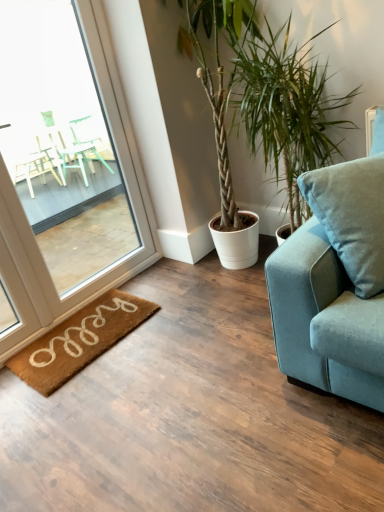
You are a GUI agent. You are given a task and a screenshot of the screen. Output one action in this format:
    pyautogui.click(x=<x>, y=<y>)
    Task: Click on the green leafy plant at center
    
    Given the screenshot: What is the action you would take?
    pyautogui.click(x=262, y=96)

Image resolution: width=384 pixels, height=512 pixels. What are the coordinates of `brown coir mat at lower left` in the screenshot? It's located at (79, 340).

What do you see at coordinates (79, 340) in the screenshot? This screenshot has width=384, height=512. I see `brown coir mat at lower left` at bounding box center [79, 340].

Image resolution: width=384 pixels, height=512 pixels. In order to click on clear glass window at left in this screenshot , I will do `click(64, 169)`.

The height and width of the screenshot is (512, 384). What are the coordinates of `velvet blue couch at right` in the screenshot? It's located at (324, 320).

At what (x,y) coordinates should I click in order to perform the action: click on green leafy plant at center. Please return your answer as a coordinate pair (x, y). Looking at the image, I should click on (262, 96).

Does velvet blue couch at right appear on the right side of green leafy plant at center?

Correct, you'll find velvet blue couch at right to the right of green leafy plant at center.

Relative to green leafy plant at center, is velvet blue couch at right in front or behind?

In the image, velvet blue couch at right appears in front of green leafy plant at center.

From the image's perspective, which is above, velvet blue couch at right or green leafy plant at center?

green leafy plant at center appears higher in the image.

Between point (306, 226) and point (255, 149), which one is positioned behind?

The point (255, 149) is behind.

Find the location of a particular element. The height and width of the screenshot is (512, 384). window that is behind the velvet blue couch at right is located at coordinates pos(64,169).

Can you confirm if clear glass window at left is smaller than velvet blue couch at right?

No, clear glass window at left is not smaller than velvet blue couch at right.

Based on the photo, in terms of height, does clear glass window at left look taller or shorter compared to velvet blue couch at right?

clear glass window at left is taller than velvet blue couch at right.

Considering the relative sizes of clear glass window at left and velvet blue couch at right in the image provided, is clear glass window at left wider than velvet blue couch at right?

No.

Which is closer to the camera, (x=354, y=334) or (x=16, y=370)?

Point (x=354, y=334) is positioned closer to the camera compared to point (x=16, y=370).

Considering the sizes of objects velvet blue couch at right and brown coir mat at lower left in the image provided, who is taller, velvet blue couch at right or brown coir mat at lower left?

velvet blue couch at right is taller.

Looking at this image, from a real-world perspective, is velvet blue couch at right beneath brown coir mat at lower left?

No, from a real-world perspective, velvet blue couch at right is not below brown coir mat at lower left.

From the picture: Based on their positions, is clear glass window at left located to the left or right of green leafy plant at center?

Based on their positions, clear glass window at left is located to the left of green leafy plant at center.

From the image's perspective, is clear glass window at left under green leafy plant at center?

Yes.

Considering the relative sizes of clear glass window at left and green leafy plant at center in the image provided, is clear glass window at left taller than green leafy plant at center?

Yes, clear glass window at left is taller than green leafy plant at center.

Is green leafy plant at center inside clear glass window at left?

No, green leafy plant at center is not inside clear glass window at left.

Is point (254, 15) farther from viewer compared to point (35, 385)?

That is True.

Considering the relative sizes of green leafy plant at center and brown coir mat at lower left in the image provided, is green leafy plant at center wider than brown coir mat at lower left?

Correct, the width of green leafy plant at center exceeds that of brown coir mat at lower left.

In the image, is green leafy plant at center on the left side or the right side of brown coir mat at lower left?

In the image, green leafy plant at center appears on the right side of brown coir mat at lower left.

From a real-world perspective, between clear glass window at left and brown coir mat at lower left, who is vertically lower?

From a 3D spatial view, brown coir mat at lower left is below.

Does clear glass window at left come behind brown coir mat at lower left?

No, it is in front of brown coir mat at lower left.

From the image's perspective, which one is positioned higher, clear glass window at left or brown coir mat at lower left?

clear glass window at left.

Can you confirm if clear glass window at left is taller than brown coir mat at lower left?

Yes.

Considering the sizes of objects brown coir mat at lower left and clear glass window at left in the image provided, who is shorter, brown coir mat at lower left or clear glass window at left?

With less height is brown coir mat at lower left.

Would you say clear glass window at left is part of brown coir mat at lower left's contents?

That's incorrect, clear glass window at left is not inside brown coir mat at lower left.

In the image, is brown coir mat at lower left positioned in front of or behind clear glass window at left?

Clearly, brown coir mat at lower left is behind clear glass window at left.

Is brown coir mat at lower left directly adjacent to clear glass window at left?

brown coir mat at lower left is not next to clear glass window at left, and they're not touching.

What are the coordinates of `studio couch below the green leafy plant at center (from a real-world perspective)` in the screenshot? It's located at (324, 320).

The width and height of the screenshot is (384, 512). I want to click on studio couch below the clear glass window at left (from the image's perspective), so click(324, 320).

In the scene shown: From the image, which object appears to be nearer to velvet blue couch at right, clear glass window at left or green leafy plant at center?

green leafy plant at center.

Considering their positions, is brown coir mat at lower left positioned closer to velvet blue couch at right than clear glass window at left?

The object closer to velvet blue couch at right is brown coir mat at lower left.

When comparing their distances from velvet blue couch at right, does brown coir mat at lower left or green leafy plant at center seem further?

brown coir mat at lower left.

Consider the image. Based on their spatial positions, is velvet blue couch at right or clear glass window at left further from brown coir mat at lower left?

The object further to brown coir mat at lower left is velvet blue couch at right.

Looking at the image, which one is located closer to clear glass window at left, green leafy plant at center or velvet blue couch at right?

Among the two, green leafy plant at center is located nearer to clear glass window at left.

Estimate the real-world distances between objects in this image. Which object is further from green leafy plant at center, velvet blue couch at right or brown coir mat at lower left?

brown coir mat at lower left is positioned further to the anchor green leafy plant at center.

Based on their spatial positions, is velvet blue couch at right or green leafy plant at center further from clear glass window at left?

velvet blue couch at right.

Which object lies nearer to the anchor point green leafy plant at center, brown coir mat at lower left or clear glass window at left?

Among the two, clear glass window at left is located nearer to green leafy plant at center.

The height and width of the screenshot is (512, 384). I want to click on houseplant between clear glass window at left and velvet blue couch at right in the horizontal direction, so click(x=262, y=96).

At what (x,y) coordinates should I click in order to perform the action: click on mat between clear glass window at left and velvet blue couch at right. Please return your answer as a coordinate pair (x, y). This screenshot has width=384, height=512. Looking at the image, I should click on (79, 340).

Find the location of `mat between clear glass window at left and green leafy plant at center in the horizontal direction`. mat between clear glass window at left and green leafy plant at center in the horizontal direction is located at coordinates (79, 340).

Locate an element on the screen. houseplant between brown coir mat at lower left and velvet blue couch at right from left to right is located at coordinates (262, 96).